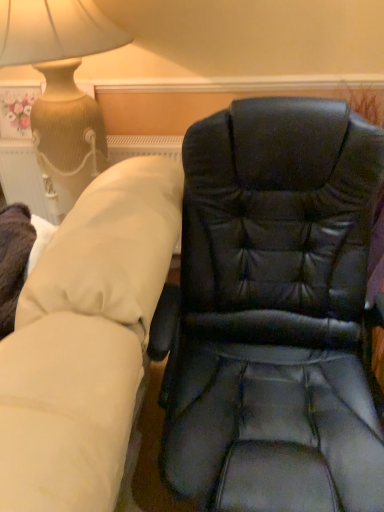
The image size is (384, 512). What do you see at coordinates (86, 340) in the screenshot?
I see `beige fabric couch at left` at bounding box center [86, 340].

Locate an element on the screen. beige fabric couch at left is located at coordinates (86, 340).

Based on the photo, measure the distance between point (106, 212) and camera.

The depth of point (106, 212) is 3.30 feet.

Locate an element on the screen. This screenshot has height=512, width=384. beige fabric couch at left is located at coordinates (86, 340).